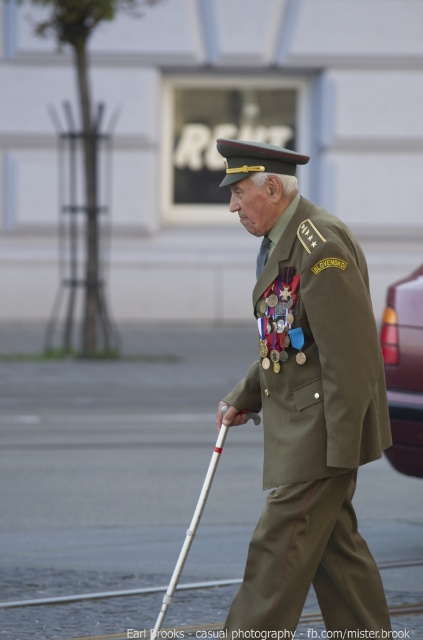
You are a photographer standing at the camera position. You need to take a photo of the elderly man in the military uniform. However, there is a point at coordinate point (272, 419) that must be included in the photo. Given that the point is 6.31 meters away from the camera, can you estimate whether the point will be in the frame if you focus on the elderly man?

The point at coordinate point (272, 419) is 6.31 meters away from the camera. Since the elderly man is the main subject and the point is at that distance, it is likely within the frame if the camera is focused on him.